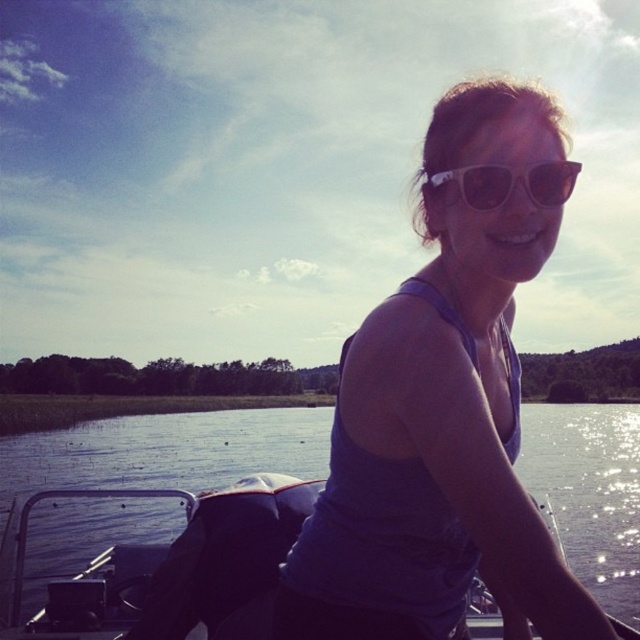
You are a photographer trying to capture a clear shot of the purple fabric tank top at center and the transparent water at center. If your camera has a maximum focus range of 10 meters, will you be able to focus on both subjects simultaneously?

The distance between the purple fabric tank top at center and the transparent water at center is 15.37 meters, so the camera cannot focus on both at the same time since the maximum range is 10 meters.

You are a photographer trying to capture the perfect shot of the person in the boat. You notice the purple fabric tank top at center and the white plastic sunglasses at center. Which object is positioned more to the left side of the image?

The purple fabric tank top at center is positioned more to the left side of the image than the white plastic sunglasses at center.